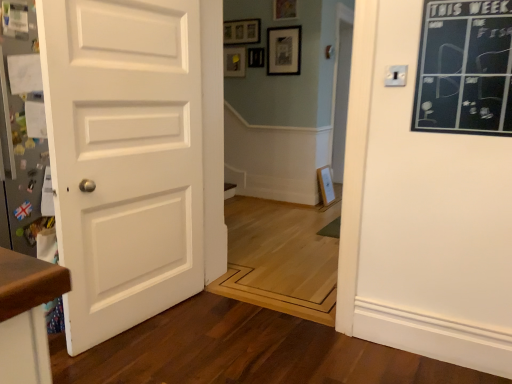
Question: Does black chalkboard at upper right have a smaller size compared to matte black picture frame at upper center, the 1th picture frame in the bottom-to-top sequence?

Choices:
 (A) yes
 (B) no

Answer: (B)

Question: Does black chalkboard at upper right have a lesser width compared to matte black picture frame at upper center, the 1th picture frame in the bottom-to-top sequence?

Choices:
 (A) yes
 (B) no

Answer: (B)

Question: Is black chalkboard at upper right aimed at matte black picture frame at upper center, the 1th picture frame in the bottom-to-top sequence?

Choices:
 (A) yes
 (B) no

Answer: (B)

Question: Is black chalkboard at upper right in contact with matte black picture frame at upper center, which appears as the third picture frame when viewed from the top?

Choices:
 (A) no
 (B) yes

Answer: (A)

Question: Is black chalkboard at upper right shorter than matte black picture frame at upper center, which appears as the third picture frame when viewed from the top?

Choices:
 (A) yes
 (B) no

Answer: (B)

Question: From the image's perspective, is matte black picture frame at upper center, which appears as the third picture frame when viewed from the top, located above or below white matte door at left?

Choices:
 (A) below
 (B) above

Answer: (B)

Question: Considering the positions of matte black picture frame at upper center, the 1th picture frame in the bottom-to-top sequence, and white matte door at left in the image, is matte black picture frame at upper center, the 1th picture frame in the bottom-to-top sequence, bigger or smaller than white matte door at left?

Choices:
 (A) small
 (B) big

Answer: (A)

Question: In terms of width, does matte black picture frame at upper center, which appears as the third picture frame when viewed from the top, look wider or thinner when compared to white matte door at left?

Choices:
 (A) thin
 (B) wide

Answer: (A)

Question: Would you say matte black picture frame at upper center, the 1th picture frame in the bottom-to-top sequence, is inside or outside white matte door at left?

Choices:
 (A) inside
 (B) outside

Answer: (B)

Question: From the image's perspective, relative to matte black picture frame at upper center, positioned as the 2th picture frame in bottom-to-top order, is matte black picture frame at upper center, which appears as the third picture frame when viewed from the top, above or below?

Choices:
 (A) above
 (B) below

Answer: (B)

Question: Is matte black picture frame at upper center, which appears as the third picture frame when viewed from the top, wider or thinner than matte black picture frame at upper center, positioned as the 2th picture frame in bottom-to-top order?

Choices:
 (A) thin
 (B) wide

Answer: (A)

Question: Considering the positions of point (250, 64) and point (289, 44), is point (250, 64) closer or farther from the camera than point (289, 44)?

Choices:
 (A) farther
 (B) closer

Answer: (A)

Question: Considering the positions of matte black picture frame at upper center, the 1th picture frame in the bottom-to-top sequence, and matte black picture frame at upper center, positioned as the 2th picture frame in bottom-to-top order, in the image, is matte black picture frame at upper center, the 1th picture frame in the bottom-to-top sequence, taller or shorter than matte black picture frame at upper center, positioned as the 2th picture frame in bottom-to-top order,?

Choices:
 (A) short
 (B) tall

Answer: (A)

Question: Is point (248, 61) positioned closer to the camera than point (293, 8)?

Choices:
 (A) farther
 (B) closer

Answer: (A)

Question: From a real-world perspective, is matte black picture frame at upper center, which appears as the third picture frame when viewed from the top, positioned above or below wooden picture frame at upper center, placed as the first picture frame when sorted from top to bottom?

Choices:
 (A) below
 (B) above

Answer: (A)